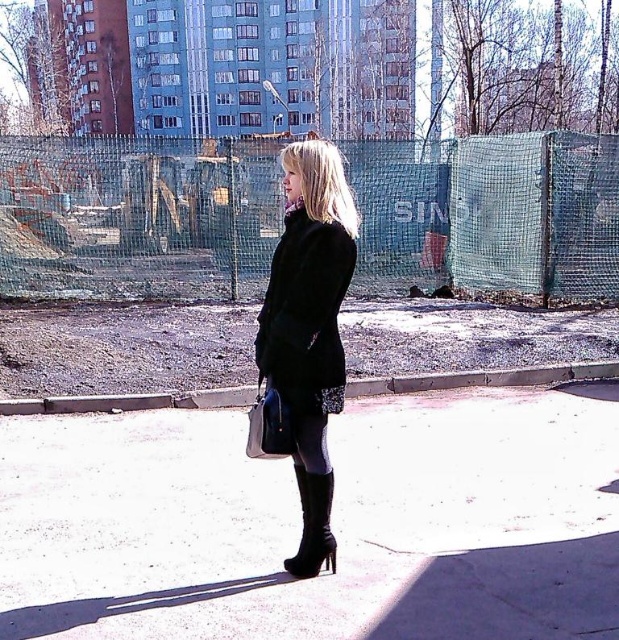
What are the coordinates of `black leather coat at center` in the screenshot? It's located at (310, 328).

Between black leather coat at center and black leather boot at lower center, which one has less height?

black leather boot at lower center

Which is behind, point (261, 378) or point (310, 557)?

The point (310, 557) is behind.

Identify the location of black leather coat at center. This screenshot has width=619, height=640. (310, 328).

Locate an element on the screen. The image size is (619, 640). black leather boots at center is located at coordinates (332, 524).

In the scene shown: Can you confirm if black leather boots at center is smaller than black wool coat at center?

Actually, black leather boots at center might be larger than black wool coat at center.

I want to click on black leather boots at center, so click(332, 524).

Where is `black leather boots at center`? This screenshot has height=640, width=619. black leather boots at center is located at coordinates (332, 524).

Which is more to the right, black leather boots at center or black leather coat at center?

Positioned to the right is black leather boots at center.

This screenshot has height=640, width=619. Find the location of `black leather boots at center`. black leather boots at center is located at coordinates (332, 524).

Where is `black leather boots at center`? black leather boots at center is located at coordinates (332, 524).